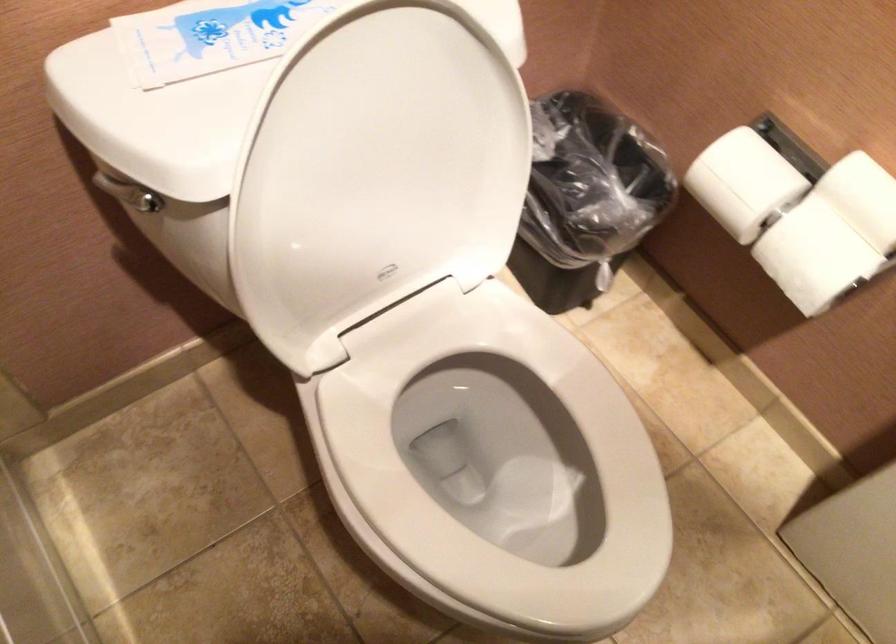
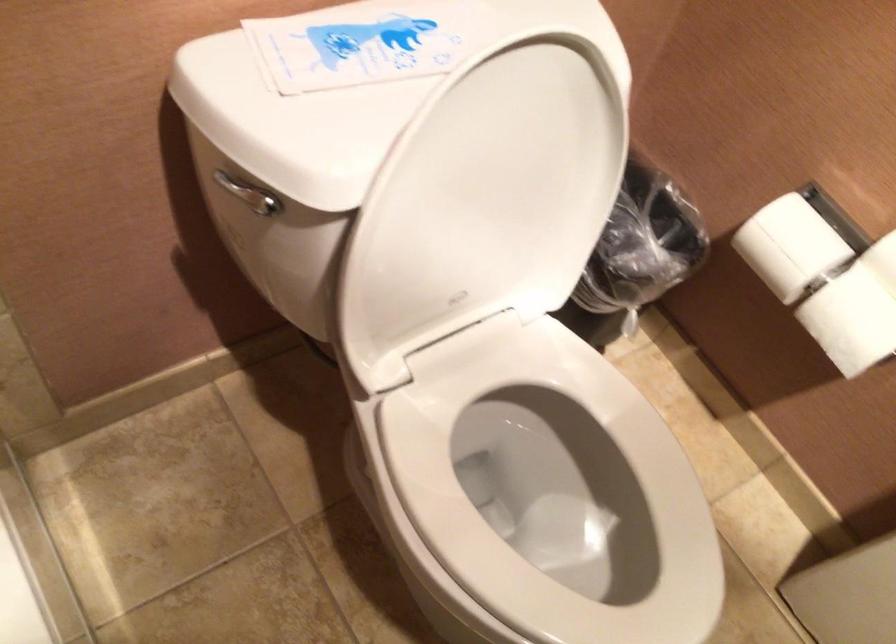
In the second image, find the point that corresponds to (x=523, y=451) in the first image.

(554, 489)